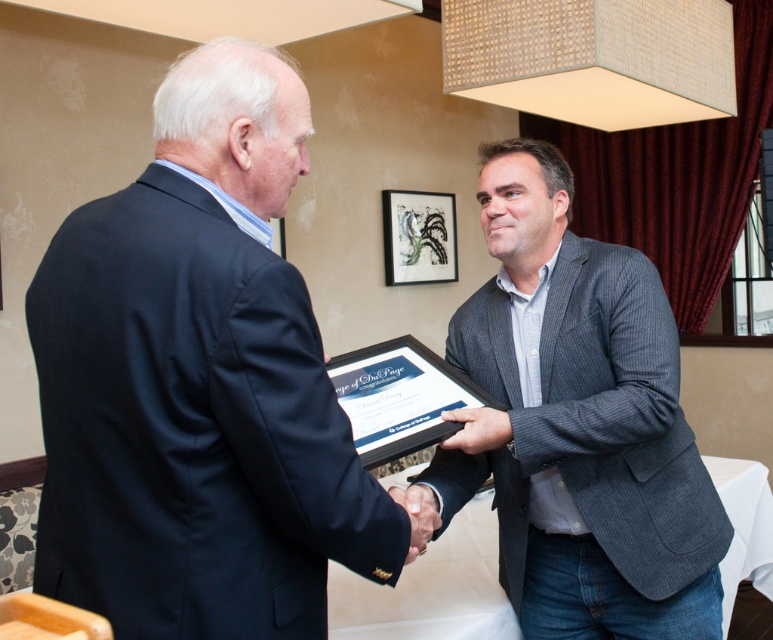
You are a photographer standing at the back of the room. You need to capture a photo where the dark blue suit at center and the matte black hand at center are clearly visible. Given that your camera has a depth of field that can focus on objects within 50 centimeters of each other, will both subjects be in focus?

The dark blue suit at center is 60.82 centimeters from the matte black hand at center. Since the distance between them exceeds the camera sensor depth of field range of 50 centimeters, the two subjects will not both be in focus simultaneously.